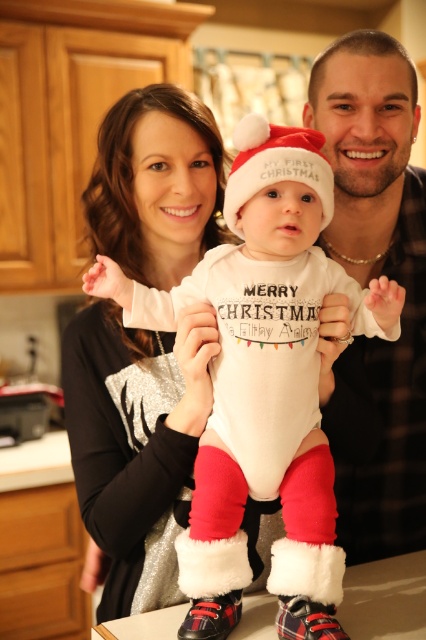
Is white cotton onesie at center smaller than matte black shirt at center?

Indeed, white cotton onesie at center has a smaller size compared to matte black shirt at center.

Does point (296, 410) come in front of point (371, 161)?

Yes, point (296, 410) is closer to viewer.

Where is `white cotton onesie at center`? The height and width of the screenshot is (640, 426). white cotton onesie at center is located at coordinates (262, 499).

Is matte silver sweater at center taller than matte black shirt at center?

In fact, matte silver sweater at center may be shorter than matte black shirt at center.

Does matte silver sweater at center appear over matte black shirt at center?

Actually, matte silver sweater at center is below matte black shirt at center.

Is point (181, 500) farther from viewer compared to point (391, 435)?

No, (181, 500) is closer to viewer.

You are a GUI agent. You are given a task and a screenshot of the screen. Output one action in this format:
    pyautogui.click(x=<x>, y=<y>)
    Task: Click on the matte silver sweater at center
    Image resolution: width=426 pixels, height=640 pixels.
    Given the screenshot: What is the action you would take?
    pyautogui.click(x=135, y=444)

Which of these two, matte silver sweater at center or white cotton onesie at center, stands taller?

Standing taller between the two is matte silver sweater at center.

How far apart are matte silver sweater at center and white cotton onesie at center?

They are 6.30 inches apart.

What do you see at coordinates (135, 444) in the screenshot?
I see `matte silver sweater at center` at bounding box center [135, 444].

What are the coordinates of `matte silver sweater at center` in the screenshot? It's located at (135, 444).